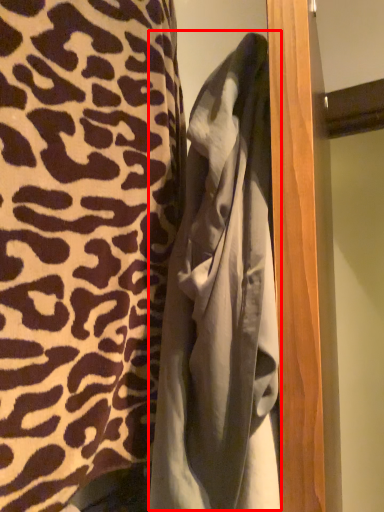
Question: In this image, where is bathrobe (annotated by the red box) located relative to curtain?

Choices:
 (A) left
 (B) right

Answer: (B)